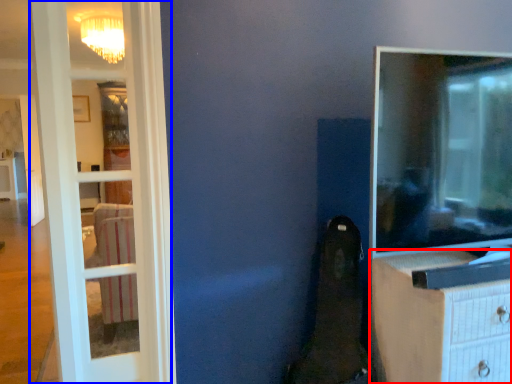
Question: Which object is further to the camera taking this photo, chest of drawers (highlighted by a red box) or door (highlighted by a blue box)?

Choices:
 (A) chest of drawers
 (B) door

Answer: (B)